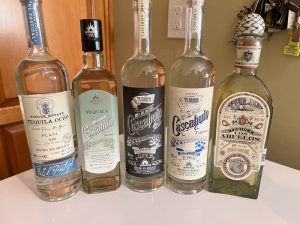
Locate an element on the screen. This screenshot has width=300, height=225. wall is located at coordinates (288, 80).